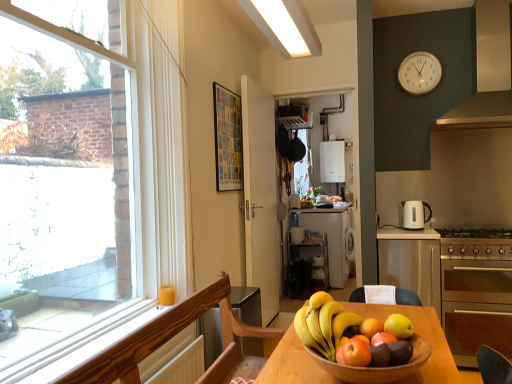
Question: Is white matte dishwasher at center not near stainless steel gas stove at right?

Choices:
 (A) yes
 (B) no

Answer: (A)

Question: Is white matte dishwasher at center bigger than stainless steel gas stove at right?

Choices:
 (A) yes
 (B) no

Answer: (A)

Question: Is white matte dishwasher at center with stainless steel gas stove at right?

Choices:
 (A) no
 (B) yes

Answer: (A)

Question: Is stainless steel gas stove at right a part of white matte dishwasher at center?

Choices:
 (A) yes
 (B) no

Answer: (B)

Question: From the image's perspective, is white matte dishwasher at center over stainless steel gas stove at right?

Choices:
 (A) no
 (B) yes

Answer: (A)

Question: Considering the relative positions of white matte dishwasher at center and stainless steel gas stove at right in the image provided, is white matte dishwasher at center to the left of stainless steel gas stove at right from the viewer's perspective?

Choices:
 (A) no
 (B) yes

Answer: (B)

Question: Does white glossy electric kettle at right have a larger size compared to stainless steel gas stove at right?

Choices:
 (A) yes
 (B) no

Answer: (B)

Question: Considering the relative positions of white glossy electric kettle at right and stainless steel gas stove at right in the image provided, is white glossy electric kettle at right to the right of stainless steel gas stove at right from the viewer's perspective?

Choices:
 (A) yes
 (B) no

Answer: (B)

Question: Is white glossy electric kettle at right to the left of stainless steel gas stove at right from the viewer's perspective?

Choices:
 (A) yes
 (B) no

Answer: (A)

Question: Does white glossy electric kettle at right have a greater width compared to stainless steel gas stove at right?

Choices:
 (A) yes
 (B) no

Answer: (B)

Question: Is stainless steel gas stove at right at the back of white glossy electric kettle at right?

Choices:
 (A) yes
 (B) no

Answer: (B)

Question: From the image's perspective, would you say white glossy electric kettle at right is positioned over stainless steel gas stove at right?

Choices:
 (A) no
 (B) yes

Answer: (B)

Question: Is white matte door at center taller than shiny yellow apple at center, the first apple when ordered from back to front?

Choices:
 (A) yes
 (B) no

Answer: (A)